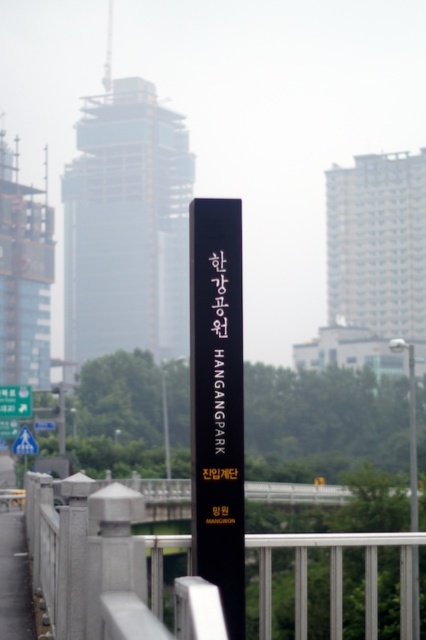
Is smooth stone railing at center positioned behind blue plastic traffic sign at upper left?

No, smooth stone railing at center is closer to the viewer.

Is smooth stone railing at center above blue plastic traffic sign at upper left?

Yes.

Who is more forward, (267, 632) or (37, 428)?

Point (267, 632) is in front.

Where is `smooth stone railing at center`? The image size is (426, 640). smooth stone railing at center is located at coordinates (106, 564).